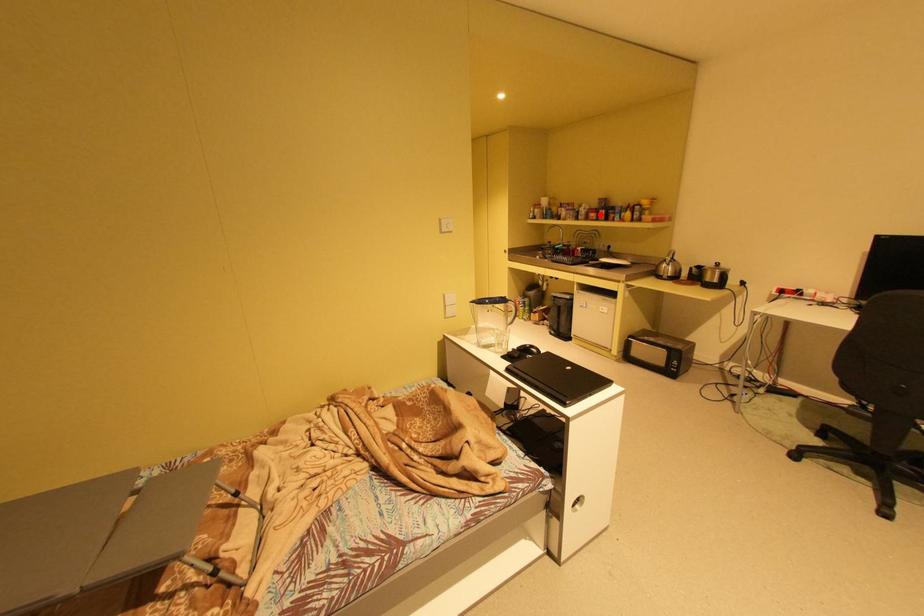
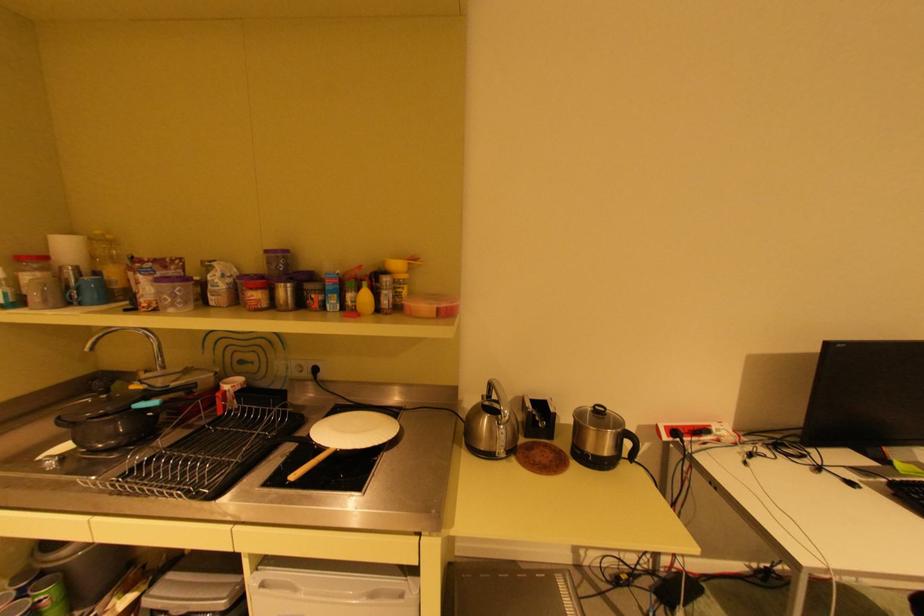
In the second image, find the point that corresponds to the highlighted location in the first image.

(264, 294)